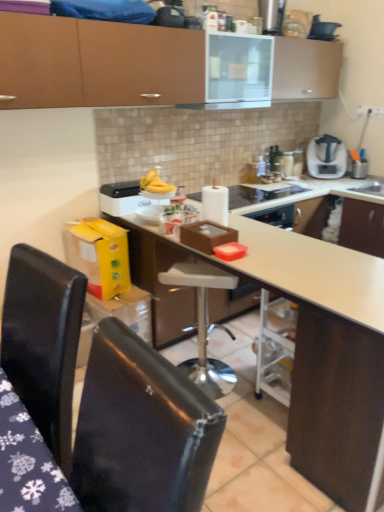
Question: In terms of width, does black plastic kettle at upper center look wider or thinner when compared to satin silver blender at upper right?

Choices:
 (A) wide
 (B) thin

Answer: (B)

Question: Relative to satin silver blender at upper right, is black plastic kettle at upper center in front or behind?

Choices:
 (A) front
 (B) behind

Answer: (A)

Question: Considering the real-world distances, which object is farthest from the white matte countertop at center?

Choices:
 (A) satin silver blender at upper right
 (B) black leather chair at lower left, placed as the 1th chair when sorted from left to right
 (C) white plastic toaster at upper center
 (D) white plastic bar stool at center
 (E) matte brown cabinet at upper center

Answer: (A)

Question: Which of these objects is positioned closest to the satin silver blender at upper right?

Choices:
 (A) white plastic bar stool at center
 (B) white plastic toaster at upper center
 (C) black plastic kettle at upper center
 (D) black leather chair at lower left, placed as the 1th chair when sorted from left to right
 (E) white glossy exhaust hood at upper center

Answer: (C)